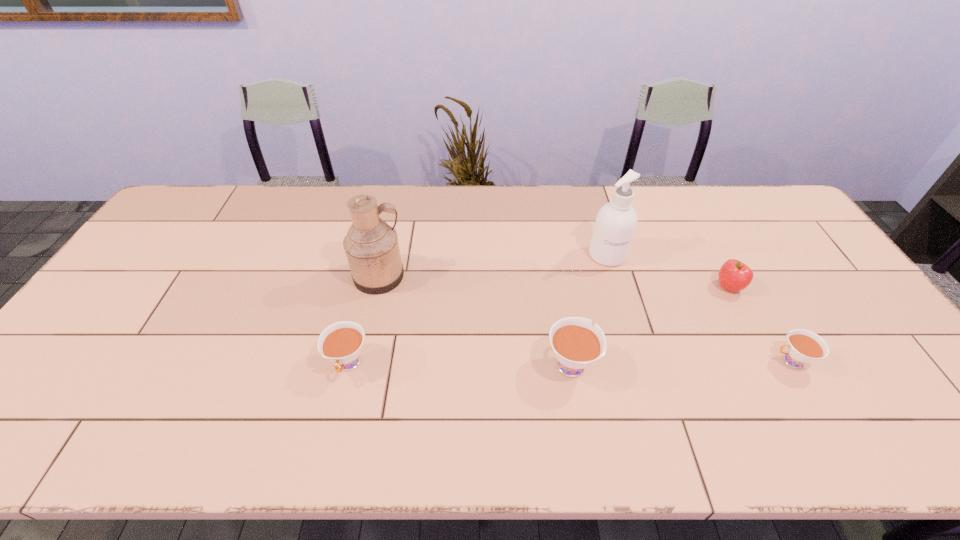
The image size is (960, 540). Find the location of `the second shortest teacup`. the second shortest teacup is located at coordinates (341, 342).

Find the location of a particular element. The width and height of the screenshot is (960, 540). the tallest teacup is located at coordinates (576, 344).

I want to click on the third object from left to right, so tap(576, 344).

You are a GUI agent. You are given a task and a screenshot of the screen. Output one action in this format:
    pyautogui.click(x=<x>, y=<y>)
    Task: Click on the shortest object
    The width and height of the screenshot is (960, 540).
    Given the screenshot: What is the action you would take?
    pyautogui.click(x=803, y=346)

The height and width of the screenshot is (540, 960). Find the location of `the rightmost teacup`. the rightmost teacup is located at coordinates (803, 346).

Identify the location of the third object from right to left. (616, 221).

Locate an element on the screen. The image size is (960, 540). pitcher is located at coordinates (371, 245).

The height and width of the screenshot is (540, 960). In order to click on apple in this screenshot , I will do `click(733, 276)`.

You are a GUI agent. You are given a task and a screenshot of the screen. Output one action in this format:
    pyautogui.click(x=<x>, y=<y>)
    Task: Click on the free point located 0.190m on the side of the third object from left to right with the handle
    This screenshot has width=960, height=540.
    Given the screenshot: What is the action you would take?
    pyautogui.click(x=557, y=285)

In order to click on free spot located 0.380m on the side of the third object from left to right with the handle in this screenshot , I will do `click(550, 241)`.